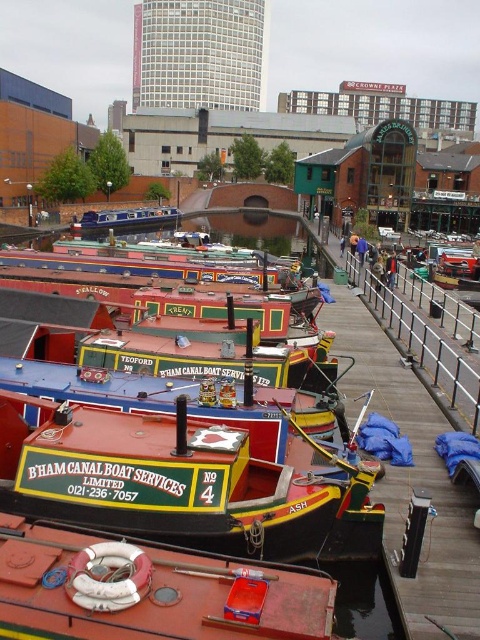
You are a delivery person needing to load a large crate onto one of the boats. The crate requires a minimum width of 3 meters to be safely placed. Given the information about the boats, which boat between the rustic wood boat at lower center and the matte blue boat at center would you choose?

The matte blue boat at center has a greater width than the rustic wood boat at lower center, so you should choose the matte blue boat at center to safely load the large crate.

You are standing on the wooden pier at the canal basin and see the rustic wood boat at lower center. If you want to board this boat, which direction should you walk along the pier to reach it?

The rustic wood boat at lower center is located at point (147,589), so you should walk towards the lower center of the pier to reach it.

You are a visitor at the canal basin and want to board the closest boat to the pier. Which boat should you choose between the rustic wood boat at lower center and the matte blue boat at center?

The rustic wood boat at lower center is closer to the pier than the matte blue boat at center because it occupies less space, so you should choose the rustic wood boat at lower center.